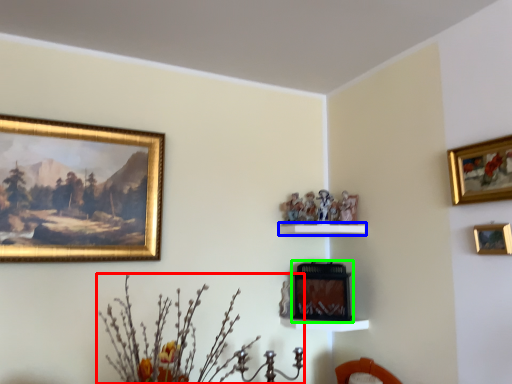
Question: Which object is positioned closest to floral arrangement (highlighted by a red box)? Select from shelf (highlighted by a blue box) and picture frame (highlighted by a green box).

Choices:
 (A) shelf
 (B) picture frame

Answer: (B)